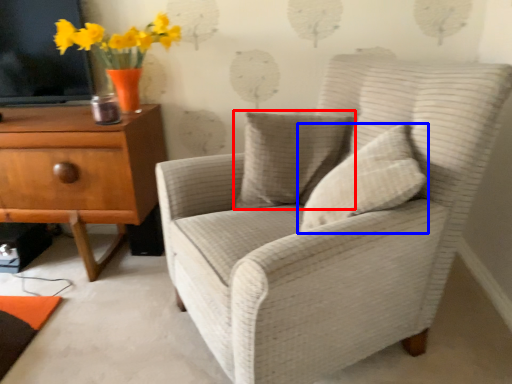
Question: Which of the following is the closest to the observer, pillow (highlighted by a red box) or pillow (highlighted by a blue box)?

Choices:
 (A) pillow
 (B) pillow

Answer: (B)